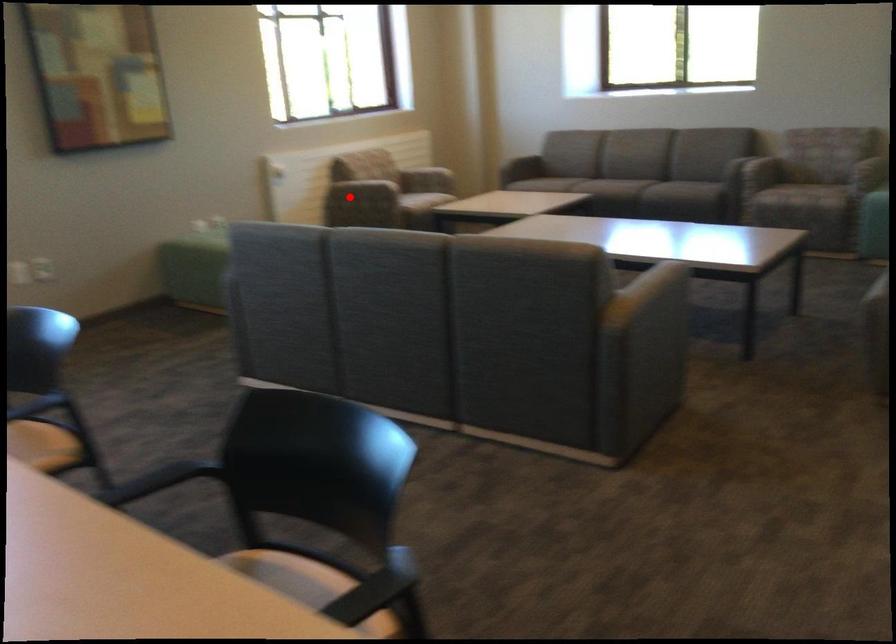
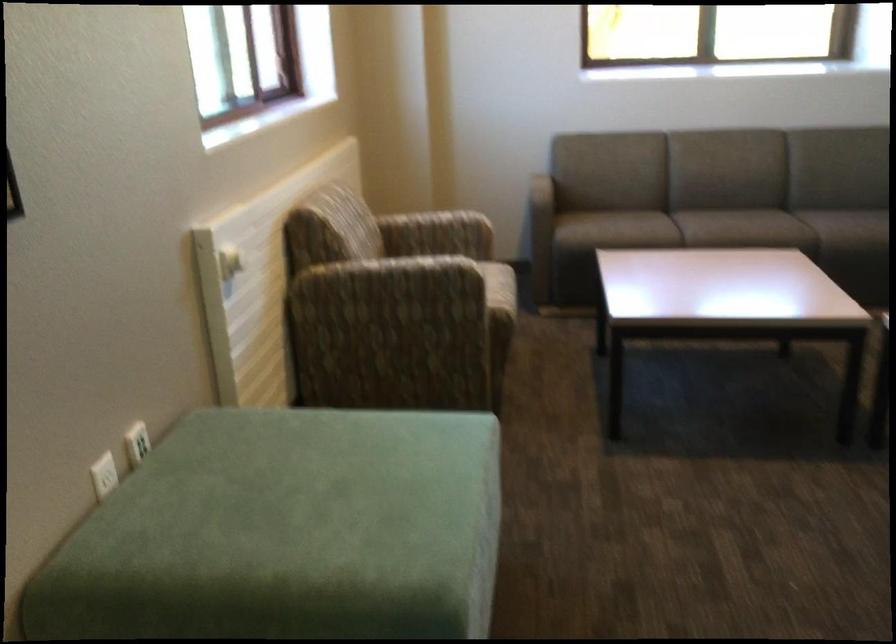
Question: I am providing you with two images of the same scene from different viewpoints. Given a red point in image1, look at the same physical point in image2. Is it:

Choices:
 (A) Closer to the viewpoint
 (B) Farther from the viewpoint

Answer: (A)